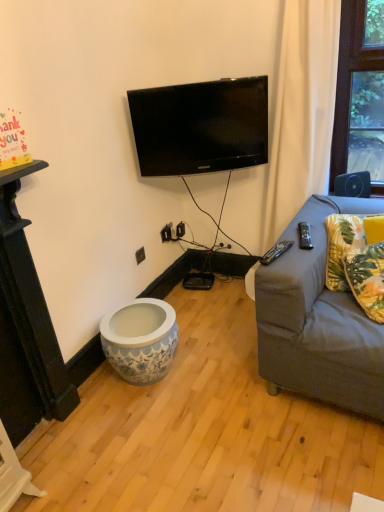
What do you see at coordinates (140, 255) in the screenshot? I see `black plastic outlet at lower center` at bounding box center [140, 255].

The height and width of the screenshot is (512, 384). What do you see at coordinates (276, 252) in the screenshot? I see `black plastic remote control at right, which is the first remote control from left to right` at bounding box center [276, 252].

What do you see at coordinates (305, 236) in the screenshot? This screenshot has height=512, width=384. I see `black plastic remote control at right, the first remote control viewed from the right` at bounding box center [305, 236].

What do you see at coordinates (367, 278) in the screenshot?
I see `yellow floral fabric pillow at right, acting as the second pillow starting from the back` at bounding box center [367, 278].

Locate an element on the screen. yellow fabric pillow at right, the 1th pillow from the back is located at coordinates (343, 245).

Image resolution: width=384 pixels, height=512 pixels. I want to click on black plastic outlet at lower center, so click(x=140, y=255).

Between point (379, 285) and point (260, 147), which one is positioned in front?

The point (379, 285) is closer.

How much distance is there between yellow floral fabric pillow at right, arranged as the first pillow when viewed from the front, and black glossy tv at upper center?

yellow floral fabric pillow at right, arranged as the first pillow when viewed from the front, is 36.79 inches from black glossy tv at upper center.

Can we say yellow floral fabric pillow at right, acting as the second pillow starting from the back, lies outside black glossy tv at upper center?

That's correct, yellow floral fabric pillow at right, acting as the second pillow starting from the back, is outside of black glossy tv at upper center.

Is yellow floral fabric pillow at right, arranged as the first pillow when viewed from the front, in contact with black glossy tv at upper center?

No, yellow floral fabric pillow at right, arranged as the first pillow when viewed from the front, is not in contact with black glossy tv at upper center.

Is black glossy tv at upper center positioned with its back to black plastic outlet at lower center?

No, black glossy tv at upper center's orientation is not away from black plastic outlet at lower center.

Considering the relative sizes of black glossy tv at upper center and black plastic outlet at lower center in the image provided, is black glossy tv at upper center smaller than black plastic outlet at lower center?

Incorrect, black glossy tv at upper center is not smaller in size than black plastic outlet at lower center.

Does point (258, 85) come closer to viewer compared to point (139, 254)?

That is True.

Between black glossy tv at upper center and black plastic outlet at lower center, which one appears on the right side from the viewer's perspective?

Positioned to the right is black glossy tv at upper center.

I want to click on pillow that is the 2nd object located below the black plastic remote control at right, which is the first remote control from left to right (from the image's perspective), so click(367, 278).

Is black plastic remote control at right, which is the first remote control from left to right, at the left side of yellow floral fabric pillow at right, acting as the second pillow starting from the back?

Correct, you'll find black plastic remote control at right, which is the first remote control from left to right, to the left of yellow floral fabric pillow at right, acting as the second pillow starting from the back.

Between black plastic remote control at right, which is the first remote control from left to right, and yellow floral fabric pillow at right, arranged as the first pillow when viewed from the front, which one is positioned in front?

yellow floral fabric pillow at right, arranged as the first pillow when viewed from the front, is more forward.

Considering the positions of point (270, 258) and point (381, 265), is point (270, 258) closer or farther from the camera than point (381, 265)?

Point (270, 258).

Where is `pillow lying below the yellow fabric pillow at right, the 1th pillow from the back (from the image's perspective)`? This screenshot has width=384, height=512. pillow lying below the yellow fabric pillow at right, the 1th pillow from the back (from the image's perspective) is located at coordinates point(367,278).

Is yellow floral fabric pillow at right, arranged as the first pillow when viewed from the front, to the right of yellow fabric pillow at right, the 1th pillow from the back, from the viewer's perspective?

Indeed, yellow floral fabric pillow at right, arranged as the first pillow when viewed from the front, is positioned on the right side of yellow fabric pillow at right, the 1th pillow from the back.

Consider the image. From a real-world perspective, who is located higher, yellow floral fabric pillow at right, acting as the second pillow starting from the back, or yellow fabric pillow at right, the second pillow viewed from the front?

yellow floral fabric pillow at right, acting as the second pillow starting from the back, is physically above.

In terms of width, does yellow floral fabric pillow at right, arranged as the first pillow when viewed from the front, look wider or thinner when compared to yellow fabric pillow at right, the second pillow viewed from the front?

yellow floral fabric pillow at right, arranged as the first pillow when viewed from the front, is wider than yellow fabric pillow at right, the second pillow viewed from the front.

Which is behind, point (143, 246) or point (382, 320)?

The point (143, 246) is farther from the camera.

Choose the correct answer: Is black plastic outlet at lower center inside yellow floral fabric pillow at right, acting as the second pillow starting from the back, or outside it?

black plastic outlet at lower center is spatially situated outside yellow floral fabric pillow at right, acting as the second pillow starting from the back.

In terms of width, does black plastic outlet at lower center look wider or thinner when compared to yellow floral fabric pillow at right, acting as the second pillow starting from the back?

Considering their sizes, black plastic outlet at lower center looks slimmer than yellow floral fabric pillow at right, acting as the second pillow starting from the back.

Is black glossy tv at upper center closer to the viewer compared to black plastic remote control at right, the first remote control viewed from the right?

No.

From the image's perspective, is black glossy tv at upper center above or below black plastic remote control at right, the first remote control viewed from the right?

black glossy tv at upper center is above black plastic remote control at right, the first remote control viewed from the right.

Which of these two, black glossy tv at upper center or black plastic remote control at right, the second remote control viewed from the left, is bigger?

black glossy tv at upper center is bigger.

From a real-world perspective, relative to black plastic remote control at right, which is the first remote control from left to right, is black glossy tv at upper center vertically above or below?

In terms of real-world spatial position, black glossy tv at upper center is above black plastic remote control at right, which is the first remote control from left to right.

The image size is (384, 512). What are the coordinates of `television that is on the left side of black plastic remote control at right, which is the second remote control from right to left` in the screenshot? It's located at (200, 126).

Based on the photo, which object is closer to the camera taking this photo, black glossy tv at upper center or black plastic remote control at right, which is the second remote control from right to left?

black plastic remote control at right, which is the second remote control from right to left.

Locate an element on the screen. This screenshot has width=384, height=512. television behind the yellow floral fabric pillow at right, acting as the second pillow starting from the back is located at coordinates (200, 126).

You are a GUI agent. You are given a task and a screenshot of the screen. Output one action in this format:
    pyautogui.click(x=<x>, y=<y>)
    Task: Click on the television on the right of black plastic outlet at lower center
    The image size is (384, 512).
    Given the screenshot: What is the action you would take?
    pyautogui.click(x=200, y=126)

Looking at the image, which one is located further to black plastic outlet at lower center, black plastic remote control at right, the first remote control viewed from the right, or yellow fabric pillow at right, the 1th pillow from the back?

yellow fabric pillow at right, the 1th pillow from the back, lies further to black plastic outlet at lower center than the other object.

When comparing their distances from yellow fabric pillow at right, the 1th pillow from the back, does black glossy tv at upper center or yellow floral fabric pillow at right, arranged as the first pillow when viewed from the front, seem further?

Based on the image, black glossy tv at upper center appears to be further to yellow fabric pillow at right, the 1th pillow from the back.

Which object lies nearer to the anchor point black glossy tv at upper center, black plastic outlet at lower center or yellow fabric pillow at right, the second pillow viewed from the front?

Based on the image, yellow fabric pillow at right, the second pillow viewed from the front, appears to be nearer to black glossy tv at upper center.

Which object lies nearer to the anchor point black plastic remote control at right, the second remote control viewed from the left, yellow fabric pillow at right, the 1th pillow from the back, or black plastic outlet at lower center?

yellow fabric pillow at right, the 1th pillow from the back, is positioned closer to the anchor black plastic remote control at right, the second remote control viewed from the left.

From the picture: Considering their positions, is yellow floral fabric pillow at right, arranged as the first pillow when viewed from the front, positioned further to black plastic remote control at right, the first remote control viewed from the right, than black plastic outlet at lower center?

black plastic outlet at lower center is positioned further to the anchor black plastic remote control at right, the first remote control viewed from the right.

From the image, which object appears to be farther from black glossy tv at upper center, black plastic remote control at right, the second remote control viewed from the left, or yellow floral fabric pillow at right, acting as the second pillow starting from the back?

yellow floral fabric pillow at right, acting as the second pillow starting from the back, is further to black glossy tv at upper center.

From the image, which object appears to be farther from yellow floral fabric pillow at right, acting as the second pillow starting from the back, yellow fabric pillow at right, the second pillow viewed from the front, or black plastic remote control at right, the first remote control viewed from the right?

black plastic remote control at right, the first remote control viewed from the right, is further to yellow floral fabric pillow at right, acting as the second pillow starting from the back.

Estimate the real-world distances between objects in this image. Which object is closer to black plastic remote control at right, the first remote control viewed from the right, yellow floral fabric pillow at right, arranged as the first pillow when viewed from the front, or black plastic remote control at right, which is the second remote control from right to left?

black plastic remote control at right, which is the second remote control from right to left, is closer to black plastic remote control at right, the first remote control viewed from the right.

Where is `pillow situated between black plastic remote control at right, which is the second remote control from right to left, and yellow floral fabric pillow at right, acting as the second pillow starting from the back, from left to right`? The width and height of the screenshot is (384, 512). pillow situated between black plastic remote control at right, which is the second remote control from right to left, and yellow floral fabric pillow at right, acting as the second pillow starting from the back, from left to right is located at coordinates (343, 245).

This screenshot has width=384, height=512. I want to click on pillow situated between black plastic remote control at right, the second remote control viewed from the left, and yellow floral fabric pillow at right, acting as the second pillow starting from the back, from left to right, so click(343, 245).

At what (x,y) coordinates should I click in order to perform the action: click on remote control located between black plastic remote control at right, which is the first remote control from left to right, and yellow floral fabric pillow at right, arranged as the first pillow when viewed from the front, in the left-right direction. Please return your answer as a coordinate pair (x, y). Looking at the image, I should click on (305, 236).

Locate an element on the screen. The width and height of the screenshot is (384, 512). pillow between black plastic outlet at lower center and yellow floral fabric pillow at right, arranged as the first pillow when viewed from the front is located at coordinates (343, 245).